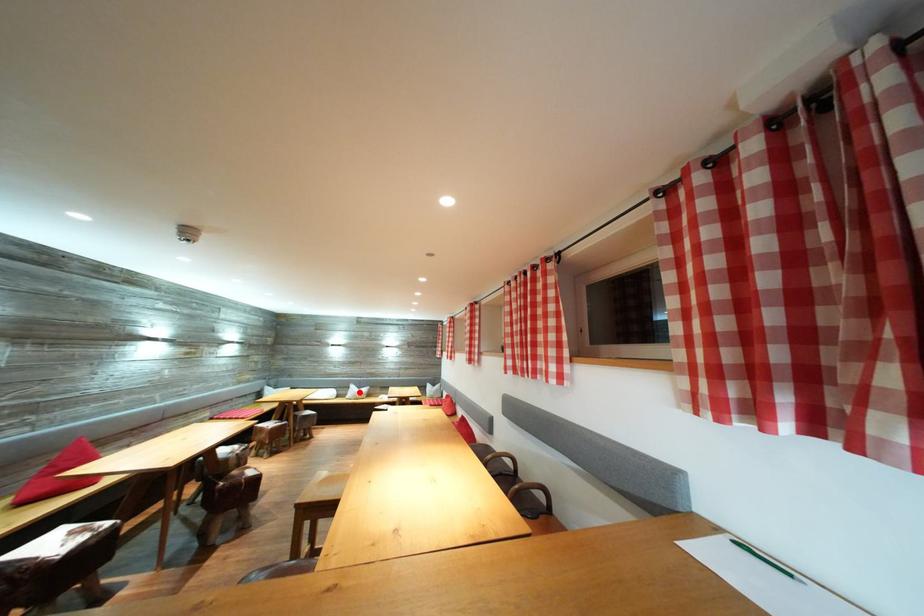
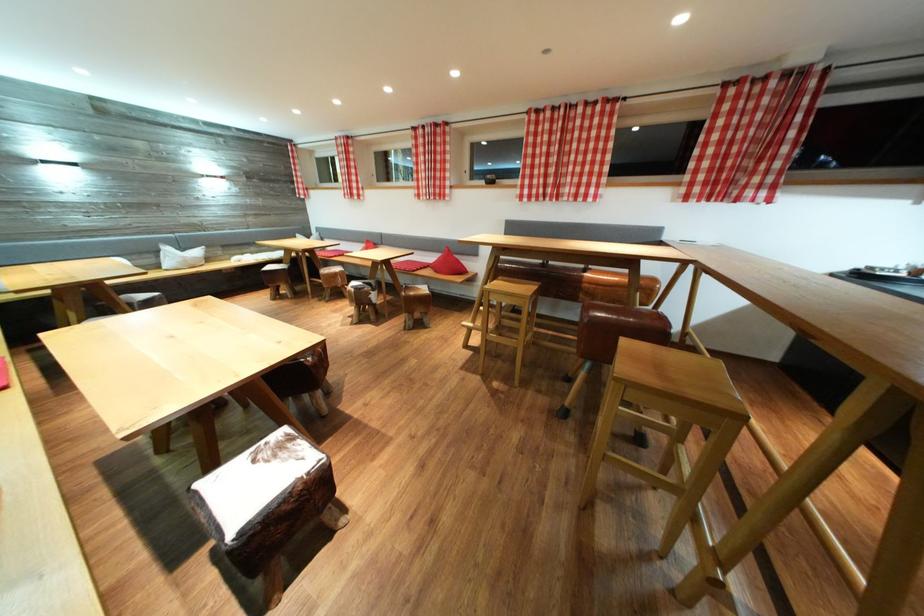
Find the pixel in the second image that matches the highlighted location in the first image.

(176, 254)